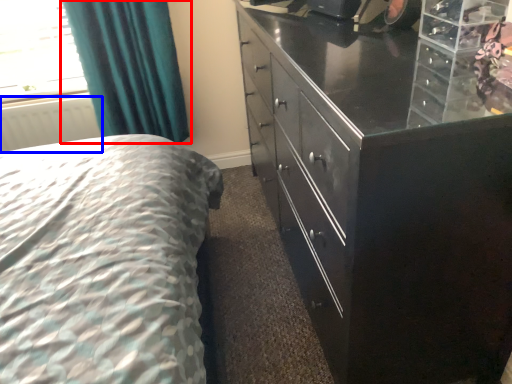
Question: Which of the following is the closest to the observer, curtain (highlighted by a red box) or radiator (highlighted by a blue box)?

Choices:
 (A) curtain
 (B) radiator

Answer: (A)